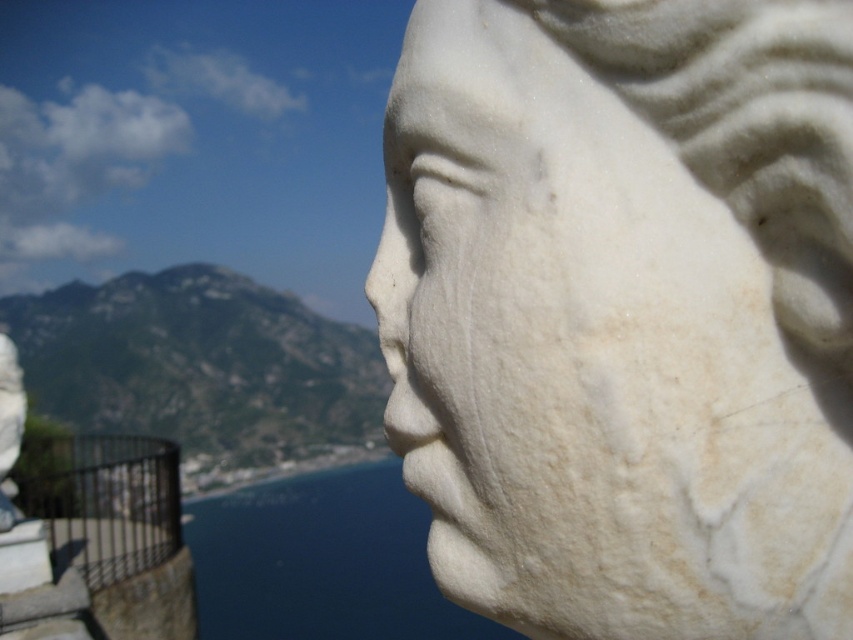
Question: Among these objects, which one is farthest from the camera?

Choices:
 (A) black metal rail at lower left
 (B) blue water at lower center
 (C) white marble bust at right
 (D) white marble statue at left

Answer: (A)

Question: From the image, what is the correct spatial relationship of white marble bust at right in relation to white marble statue at left?

Choices:
 (A) above
 (B) below

Answer: (A)

Question: Observing the image, what is the correct spatial positioning of white marble bust at right in reference to white marble statue at left?

Choices:
 (A) right
 (B) left

Answer: (A)

Question: Is white marble bust at right wider than blue water at lower center?

Choices:
 (A) yes
 (B) no

Answer: (B)

Question: Among these objects, which one is nearest to the camera?

Choices:
 (A) white marble statue at left
 (B) black metal rail at lower left
 (C) white marble bust at right
 (D) blue water at lower center

Answer: (C)

Question: Which object is positioned farthest from the black metal rail at lower left?

Choices:
 (A) white marble statue at left
 (B) blue water at lower center

Answer: (A)